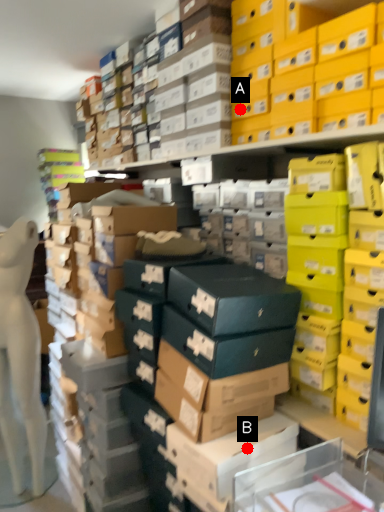
Question: Two points are circled on the image, labeled by A and B beside each circle. Which point is closer to the camera?

Choices:
 (A) A is closer
 (B) B is closer

Answer: (B)